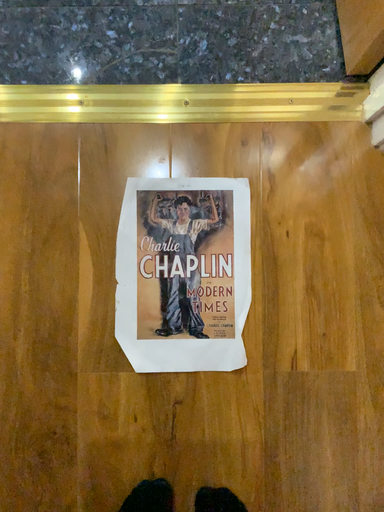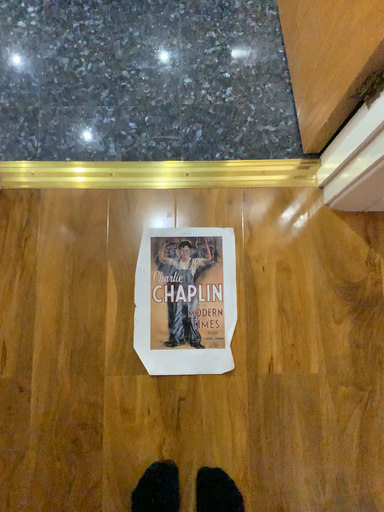
Question: Which way did the camera rotate in the video?

Choices:
 (A) rotated downward
 (B) rotated upward

Answer: (B)